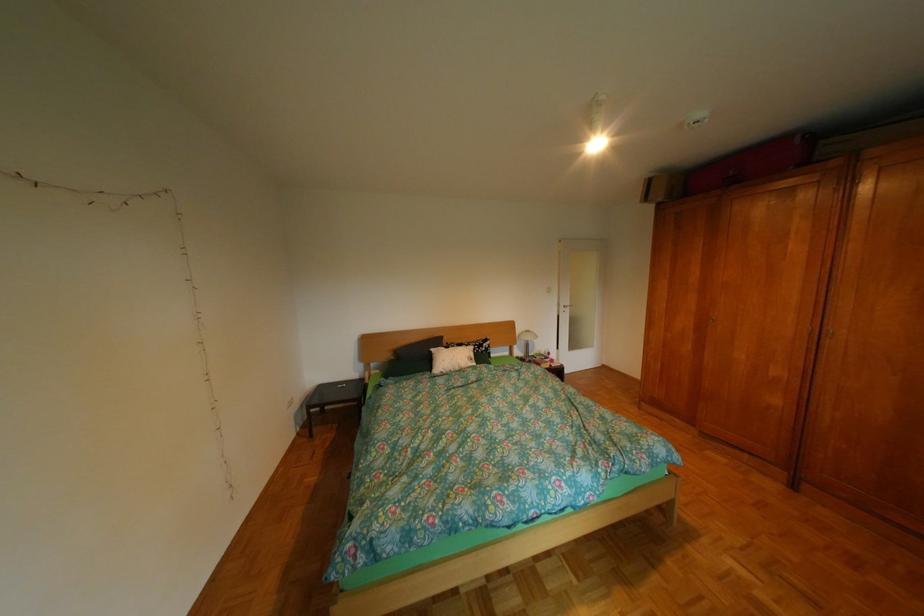
The location [411,358] corresponds to which object?

This point indicates the dark green pillow.